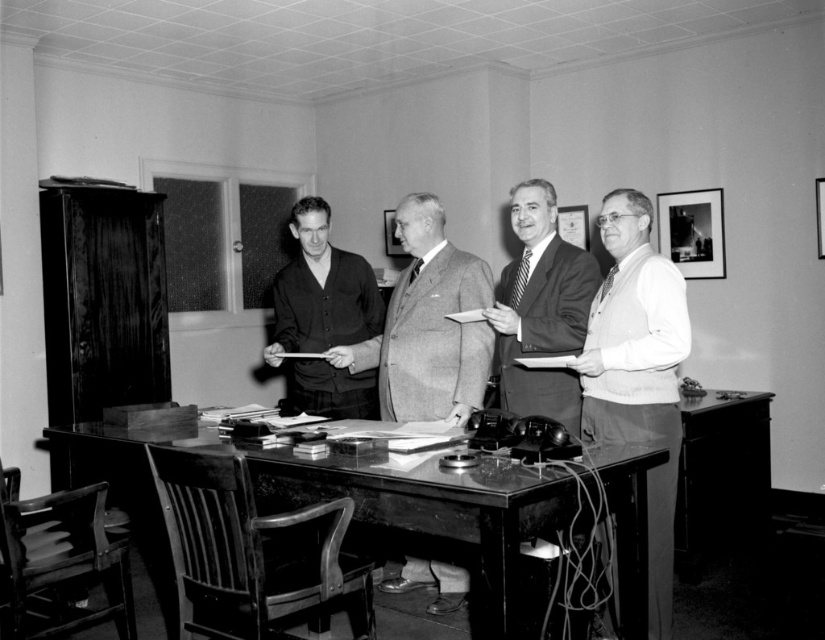
Is wooden desk at center thinner than smooth dark suit at center?

No.

Which of these two, wooden desk at center or smooth dark suit at center, stands taller?

With more height is smooth dark suit at center.

Locate an element on the screen. wooden desk at center is located at coordinates (434, 506).

Where is `wooden desk at center`? The image size is (825, 640). wooden desk at center is located at coordinates (434, 506).

Is smooth gray suit at center behind smooth dark suit at center?

Yes, smooth gray suit at center is further from the viewer.

Between point (446, 275) and point (498, 381), which one is positioned behind?

Point (498, 381)

The image size is (825, 640). Identify the location of smooth gray suit at center. (432, 323).

Is white textured vest at right positioned before dark gray cardigan at center?

Yes, white textured vest at right is in front of dark gray cardigan at center.

Who is more forward, (x=583, y=376) or (x=303, y=208)?

Positioned in front is point (x=583, y=376).

Image resolution: width=825 pixels, height=640 pixels. I want to click on white textured vest at right, so click(x=639, y=371).